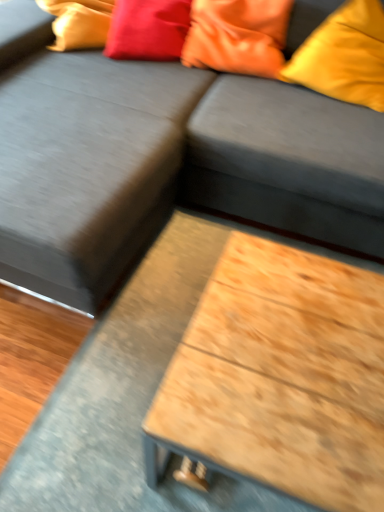
What do you see at coordinates (344, 56) in the screenshot? I see `matte orange pillow at upper right, placed as the third pillow when sorted from left to right` at bounding box center [344, 56].

What do you see at coordinates (148, 29) in the screenshot? I see `satin red pillow at upper center, arranged as the 1th pillow when viewed from the left` at bounding box center [148, 29].

What do you see at coordinates (169, 280) in the screenshot? I see `wooden table at center` at bounding box center [169, 280].

What is the approximate height of wooden table at center?

wooden table at center is 2.39 centimeters tall.

The image size is (384, 512). What are the coordinates of `wooden at lower right` in the screenshot? It's located at (288, 161).

The width and height of the screenshot is (384, 512). Find the location of `matte orange pillow at upper right, the first pillow positioned from the right`. matte orange pillow at upper right, the first pillow positioned from the right is located at coordinates coord(344,56).

Is wooden table at center outside of orange satin pillow at upper right, which is counted as the second pillow, starting from the right?

Absolutely, wooden table at center is external to orange satin pillow at upper right, which is counted as the second pillow, starting from the right.

How distant is wooden table at center from orange satin pillow at upper right, marked as the 2th pillow in a left-to-right arrangement?

A distance of 34.99 inches exists between wooden table at center and orange satin pillow at upper right, marked as the 2th pillow in a left-to-right arrangement.

Is wooden table at center facing towards orange satin pillow at upper right, which is counted as the second pillow, starting from the right?

No, wooden table at center is not turned towards orange satin pillow at upper right, which is counted as the second pillow, starting from the right.

Who is taller, wooden table at center or orange satin pillow at upper right, marked as the 2th pillow in a left-to-right arrangement?

orange satin pillow at upper right, marked as the 2th pillow in a left-to-right arrangement.

Is wooden at lower right a part of dark gray fabric couch at center?

Indeed, wooden at lower right is located within dark gray fabric couch at center.

Which is more to the left, dark gray fabric couch at center or wooden at lower right?

dark gray fabric couch at center is more to the left.

From the image's perspective, which is below, dark gray fabric couch at center or wooden at lower right?

dark gray fabric couch at center appears lower in the image.

Is wooden at lower right next to orange satin pillow at upper right, marked as the 2th pillow in a left-to-right arrangement, and touching it?

No, wooden at lower right is not making contact with orange satin pillow at upper right, marked as the 2th pillow in a left-to-right arrangement.

Between wooden at lower right and orange satin pillow at upper right, which is counted as the second pillow, starting from the right, which one has smaller width?

orange satin pillow at upper right, which is counted as the second pillow, starting from the right.

From a real-world perspective, is wooden at lower right physically above orange satin pillow at upper right, which is counted as the second pillow, starting from the right?

Incorrect, from a real-world perspective, wooden at lower right is lower than orange satin pillow at upper right, which is counted as the second pillow, starting from the right.

Which is nearer, [300,226] or [277,27]?

Point [300,226] appears to be closer to the viewer than point [277,27].

From the image's perspective, relative to matte orange pillow at upper right, the first pillow positioned from the right, is wooden table at center above or below?

wooden table at center is situated lower than matte orange pillow at upper right, the first pillow positioned from the right, in the image.

From the picture: From a real-world perspective, which object stands above the other?

matte orange pillow at upper right, placed as the third pillow when sorted from left to right.

Find the location of a particular element. This screenshot has height=512, width=384. pillow that is the 2nd object to the right of the wooden table at center, starting at the anchor is located at coordinates (344, 56).

Is wooden table at center not within matte orange pillow at upper right, placed as the third pillow when sorted from left to right?

wooden table at center lies outside matte orange pillow at upper right, placed as the third pillow when sorted from left to right,'s area.

Is satin red pillow at upper center, arranged as the 1th pillow when viewed from the left, in front of or behind wooden table at center in the image?

Clearly, satin red pillow at upper center, arranged as the 1th pillow when viewed from the left, is behind wooden table at center.

Is satin red pillow at upper center, the 3th pillow when ordered from right to left, oriented away from wooden table at center?

No, satin red pillow at upper center, the 3th pillow when ordered from right to left, is not facing the opposite direction of wooden table at center.

Which of these two, satin red pillow at upper center, arranged as the 1th pillow when viewed from the left, or wooden table at center, is bigger?

With larger size is satin red pillow at upper center, arranged as the 1th pillow when viewed from the left.

Is satin red pillow at upper center, arranged as the 1th pillow when viewed from the left, far away from wooden table at center?

Actually, satin red pillow at upper center, arranged as the 1th pillow when viewed from the left, and wooden table at center are a little close together.

From a real-world perspective, which is physically below, satin red pillow at upper center, the 3th pillow when ordered from right to left, or dark gray fabric couch at center?

dark gray fabric couch at center.

Can you tell me how much satin red pillow at upper center, arranged as the 1th pillow when viewed from the left, and dark gray fabric couch at center differ in facing direction?

There is a 14.8-degree angle between the facing directions of satin red pillow at upper center, arranged as the 1th pillow when viewed from the left, and dark gray fabric couch at center.

Considering the relative sizes of satin red pillow at upper center, the 3th pillow when ordered from right to left, and dark gray fabric couch at center in the image provided, is satin red pillow at upper center, the 3th pillow when ordered from right to left, bigger than dark gray fabric couch at center?

No.

Is satin red pillow at upper center, the 3th pillow when ordered from right to left, to the right of dark gray fabric couch at center from the viewer's perspective?

No, satin red pillow at upper center, the 3th pillow when ordered from right to left, is not to the right of dark gray fabric couch at center.

Is orange satin pillow at upper right, which is counted as the second pillow, starting from the right, at the left side of satin red pillow at upper center, arranged as the 1th pillow when viewed from the left?

No, orange satin pillow at upper right, which is counted as the second pillow, starting from the right, is not to the left of satin red pillow at upper center, arranged as the 1th pillow when viewed from the left.

Is orange satin pillow at upper right, which is counted as the second pillow, starting from the right, positioned beyond the bounds of satin red pillow at upper center, arranged as the 1th pillow when viewed from the left?

Yes, orange satin pillow at upper right, which is counted as the second pillow, starting from the right, is not within satin red pillow at upper center, arranged as the 1th pillow when viewed from the left.

Is point (260, 45) more distant than point (185, 18)?

No, (260, 45) is in front of (185, 18).

Is orange satin pillow at upper right, which is counted as the second pillow, starting from the right, oriented away from satin red pillow at upper center, the 3th pillow when ordered from right to left?

orange satin pillow at upper right, which is counted as the second pillow, starting from the right, does not have its back to satin red pillow at upper center, the 3th pillow when ordered from right to left.

Where is `table located below the orange satin pillow at upper right, which is counted as the second pillow, starting from the right (from the image's perspective)`? The width and height of the screenshot is (384, 512). table located below the orange satin pillow at upper right, which is counted as the second pillow, starting from the right (from the image's perspective) is located at coordinates (169, 280).

What are the coordinates of `footrest located on the right of dark gray fabric couch at center` in the screenshot? It's located at (288, 161).

Considering their positions, is wooden at lower right positioned closer to orange satin pillow at upper right, marked as the 2th pillow in a left-to-right arrangement, than matte orange pillow at upper right, placed as the third pillow when sorted from left to right?

matte orange pillow at upper right, placed as the third pillow when sorted from left to right, is closer to orange satin pillow at upper right, marked as the 2th pillow in a left-to-right arrangement.

Looking at the image, which one is located closer to satin red pillow at upper center, arranged as the 1th pillow when viewed from the left, matte orange pillow at upper right, the first pillow positioned from the right, or wooden at lower right?

matte orange pillow at upper right, the first pillow positioned from the right, is positioned closer to the anchor satin red pillow at upper center, arranged as the 1th pillow when viewed from the left.

Looking at this image, when comparing their distances from satin red pillow at upper center, the 3th pillow when ordered from right to left, does dark gray fabric couch at center or orange satin pillow at upper right, marked as the 2th pillow in a left-to-right arrangement, seem closer?

Based on the image, orange satin pillow at upper right, marked as the 2th pillow in a left-to-right arrangement, appears to be nearer to satin red pillow at upper center, the 3th pillow when ordered from right to left.

Looking at the image, which one is located further to wooden at lower right, wooden table at center or orange satin pillow at upper right, which is counted as the second pillow, starting from the right?

The object further to wooden at lower right is wooden table at center.

Consider the image. Considering their positions, is satin red pillow at upper center, the 3th pillow when ordered from right to left, positioned further to dark gray fabric couch at center than matte orange pillow at upper right, the first pillow positioned from the right?

The object further to dark gray fabric couch at center is satin red pillow at upper center, the 3th pillow when ordered from right to left.

Which object lies nearer to the anchor point wooden table at center, satin red pillow at upper center, arranged as the 1th pillow when viewed from the left, or matte orange pillow at upper right, the first pillow positioned from the right?

matte orange pillow at upper right, the first pillow positioned from the right, is closer to wooden table at center.

Which object lies further to the anchor point wooden at lower right, orange satin pillow at upper right, marked as the 2th pillow in a left-to-right arrangement, or satin red pillow at upper center, arranged as the 1th pillow when viewed from the left?

satin red pillow at upper center, arranged as the 1th pillow when viewed from the left, is positioned further to the anchor wooden at lower right.

Which object lies further to the anchor point matte orange pillow at upper right, the first pillow positioned from the right, dark gray fabric couch at center or wooden at lower right?

dark gray fabric couch at center.

Locate an element on the screen. The image size is (384, 512). footrest between dark gray fabric couch at center and orange satin pillow at upper right, which is counted as the second pillow, starting from the right, along the z-axis is located at coordinates click(x=288, y=161).

At what (x,y) coordinates should I click in order to perform the action: click on footrest between satin red pillow at upper center, arranged as the 1th pillow when viewed from the left, and wooden table at center in the up-down direction. Please return your answer as a coordinate pair (x, y). Looking at the image, I should click on (288, 161).

The image size is (384, 512). What are the coordinates of `the footrest that lies between orange satin pillow at upper right, which is counted as the second pillow, starting from the right, and wooden table at center from top to bottom` in the screenshot? It's located at (288, 161).

Identify the location of the footrest between matte orange pillow at upper right, placed as the third pillow when sorted from left to right, and wooden table at center vertically. This screenshot has width=384, height=512. (288, 161).